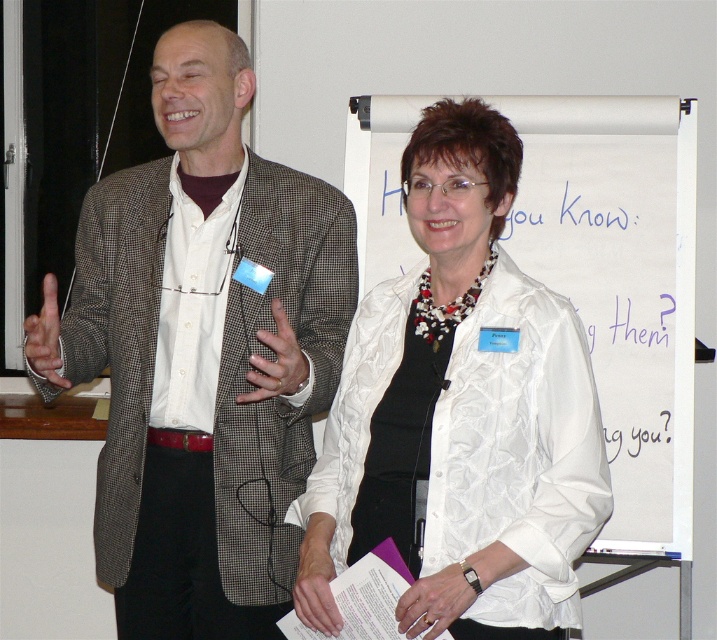
Who is more distant from viewer, (685, 522) or (44, 374)?

The point (685, 522) is behind.

Is white fabric at upper center positioned before matte black hand at left?

No, it is not.

Measure the distance between white fabric at upper center and camera.

white fabric at upper center is 8.86 feet from camera.

You are a GUI agent. You are given a task and a screenshot of the screen. Output one action in this format:
    pyautogui.click(x=<x>, y=<y>)
    Task: Click on the white fabric at upper center
    This screenshot has width=717, height=640.
    Given the screenshot: What is the action you would take?
    pyautogui.click(x=619, y=284)

Can you confirm if white satin lab coat at center is thinner than white fabric at center?

No, white satin lab coat at center is not thinner than white fabric at center.

Who is more distant from viewer, [485,490] or [450,588]?

The point [485,490] is behind.

I want to click on white satin lab coat at center, so click(516, 452).

Is checkered fabric blazer at left positioned at the back of matte black hand at left?

Yes, checkered fabric blazer at left is behind matte black hand at left.

Who is lower down, checkered fabric blazer at left or matte black hand at left?

checkered fabric blazer at left is below.

Is point (95, 323) in front of point (52, 358)?

No, it is behind (52, 358).

At what (x,y) coordinates should I click in order to perform the action: click on checkered fabric blazer at left. Please return your answer as a coordinate pair (x, y). This screenshot has height=640, width=717. Looking at the image, I should click on [x=206, y=353].